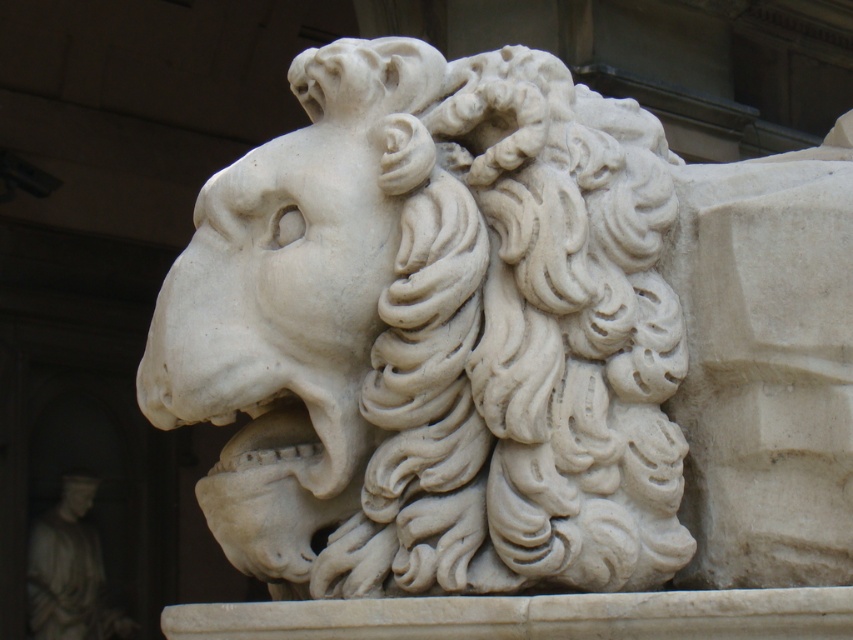
Question: Does white marble lion at center appear over white marble lion at upper center?

Choices:
 (A) yes
 (B) no

Answer: (A)

Question: Among these points, which one is nearest to the camera?

Choices:
 (A) (453, 134)
 (B) (64, 499)

Answer: (A)

Question: Is white marble lion at center further to camera compared to white marble lion at upper center?

Choices:
 (A) no
 (B) yes

Answer: (A)

Question: Among these points, which one is farthest from the camera?

Choices:
 (A) (412, 209)
 (B) (62, 516)

Answer: (B)

Question: Among these objects, which one is farthest from the camera?

Choices:
 (A) white marble lion at upper center
 (B) white marble lion at center

Answer: (A)

Question: Observing the image, what is the correct spatial positioning of white marble lion at center in reference to white marble lion at upper center?

Choices:
 (A) right
 (B) left

Answer: (A)